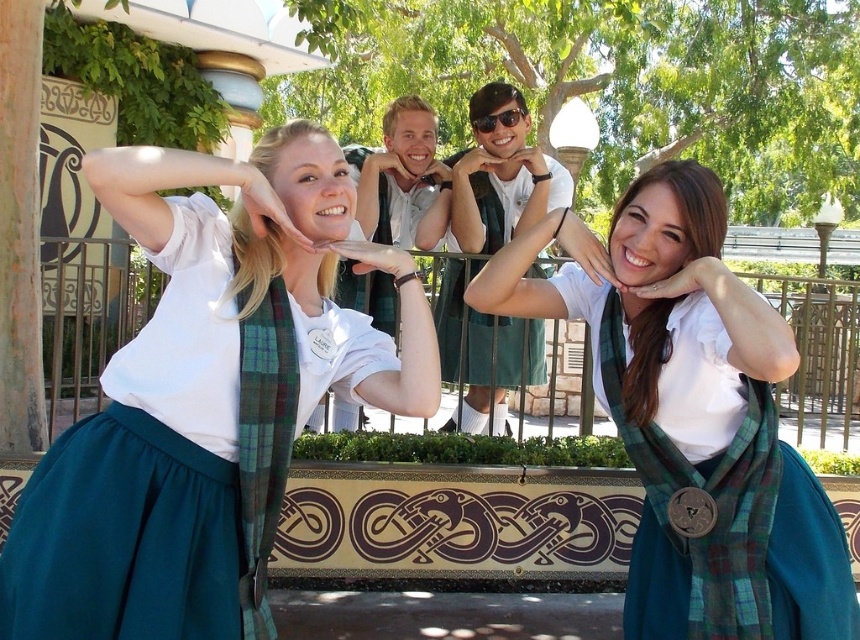
Which is below, green plaid scarf at center or plaid fabric scarf at center?

plaid fabric scarf at center is below.

Between green plaid scarf at center and plaid fabric scarf at center, which one appears on the left side from the viewer's perspective?

green plaid scarf at center is more to the left.

You are a GUI agent. You are given a task and a screenshot of the screen. Output one action in this format:
    pyautogui.click(x=<x>, y=<y>)
    Task: Click on the green plaid scarf at center
    The height and width of the screenshot is (640, 860).
    Given the screenshot: What is the action you would take?
    pyautogui.click(x=204, y=400)

Is point (521, 179) positioned behind point (392, 157)?

Yes, point (521, 179) is farther from viewer.

Locate an element on the screen. This screenshot has height=640, width=860. matte green skirt at center is located at coordinates (501, 173).

Can you confirm if matte green skirt at center is wider than matte green scarf at center?

Yes.

This screenshot has width=860, height=640. Describe the element at coordinates (501, 173) in the screenshot. I see `matte green skirt at center` at that location.

Where is `matte green skirt at center`? This screenshot has width=860, height=640. matte green skirt at center is located at coordinates (501, 173).